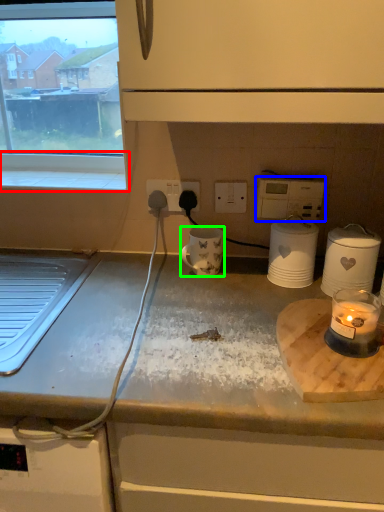
Question: Estimate the real-world distances between objects in this image. Which object is closer to window sill (highlighted by a red box), appliance (highlighted by a blue box) or mug (highlighted by a green box)?

Choices:
 (A) appliance
 (B) mug

Answer: (B)